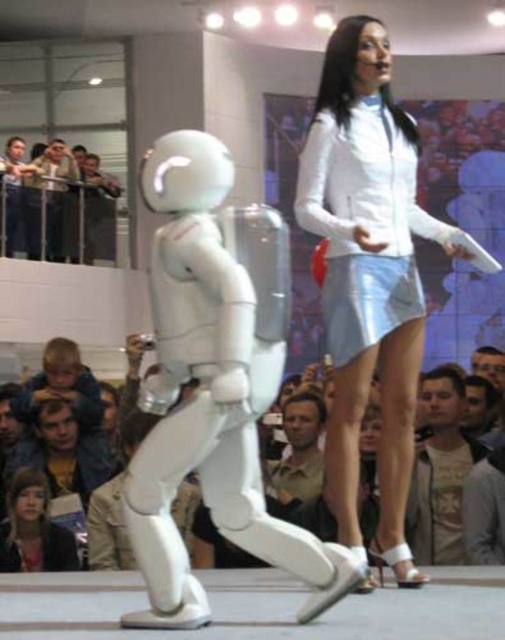
Is white leather skirt at upper right in front of light brown leather jacket at lower right?

Yes.

Is white leather skirt at upper right positioned behind light brown leather jacket at lower right?

No, white leather skirt at upper right is in front of light brown leather jacket at lower right.

Image resolution: width=505 pixels, height=640 pixels. Find the location of `white leather skirt at upper right`. white leather skirt at upper right is located at coordinates point(368,273).

You are a GUI agent. You are given a task and a screenshot of the screen. Output one action in this format:
    pyautogui.click(x=<x>, y=<y>)
    Task: Click on the white leather skirt at upper right
    Image resolution: width=505 pixels, height=640 pixels.
    Given the screenshot: What is the action you would take?
    pyautogui.click(x=368, y=273)

Is light blue leather skirt at center wider than light brown leather jacket at lower right?

Correct, the width of light blue leather skirt at center exceeds that of light brown leather jacket at lower right.

Is light blue leather skirt at center thinner than light brown leather jacket at lower right?

No, light blue leather skirt at center is not thinner than light brown leather jacket at lower right.

In the scene shown: Measure the distance between point [377,333] and camera.

Point [377,333] is 14.45 meters away from camera.

At what (x,y) coordinates should I click in order to perform the action: click on light blue leather skirt at center. Please return your answer as a coordinate pair (x, y). The height and width of the screenshot is (640, 505). Looking at the image, I should click on (364, 209).

Looking at this image, which is more to the left, smooth skin crowd at center or brown leather jacket at lower center?

smooth skin crowd at center

Does point (118, 436) come farther from viewer compared to point (309, 499)?

Yes, it is.

The image size is (505, 640). Describe the element at coordinates (101, 529) in the screenshot. I see `smooth skin crowd at center` at that location.

Image resolution: width=505 pixels, height=640 pixels. I want to click on smooth skin crowd at center, so coord(101,529).